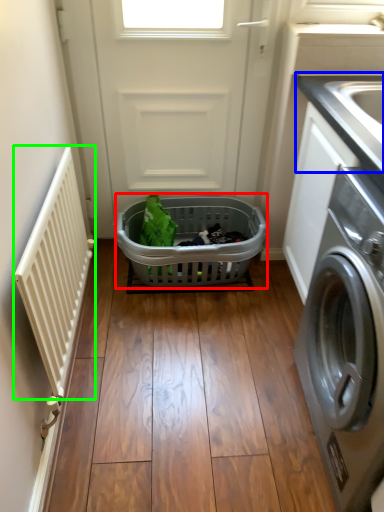
Question: Which object is the farthest from basket (highlighted by a red box)? Choose among these: counter top (highlighted by a blue box) or balustrade (highlighted by a green box).

Choices:
 (A) counter top
 (B) balustrade

Answer: (A)